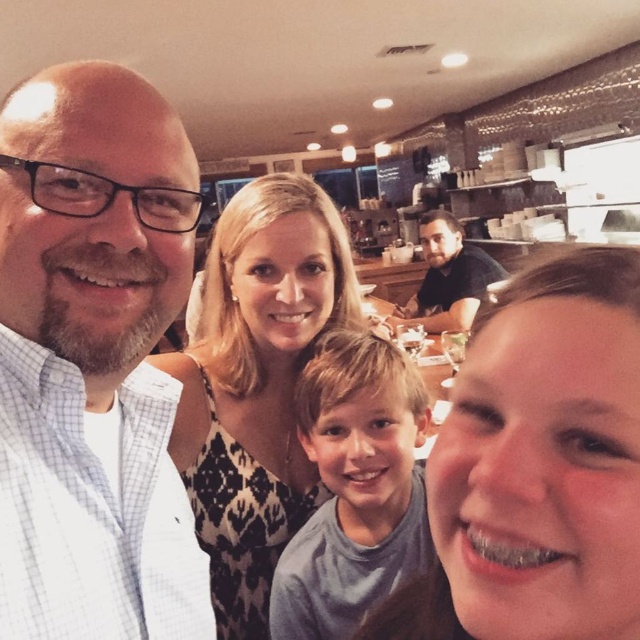
Can you confirm if smooth skin face at lower right is thinner than gray cotton shirt at center?

Correct, smooth skin face at lower right's width is less than gray cotton shirt at center's.

Is point (547, 337) positioned behind point (316, 452)?

No.

Does point (508, 534) come in front of point (305, 429)?

Yes, point (508, 534) is closer to viewer.

Image resolution: width=640 pixels, height=640 pixels. In order to click on smooth skin face at lower right in this screenshot , I will do `click(538, 467)`.

Measure the distance from black printed dress at center to dark brown leather jacket at center.

black printed dress at center is 2.16 meters from dark brown leather jacket at center.

Does point (260, 218) come in front of point (440, 248)?

Yes, point (260, 218) is in front of point (440, 248).

I want to click on black printed dress at center, so click(x=257, y=384).

Is gray cotton shirt at center taller than dark brown leather jacket at center?

Incorrect, gray cotton shirt at center's height is not larger of dark brown leather jacket at center's.

Locate an element on the screen. The width and height of the screenshot is (640, 640). gray cotton shirt at center is located at coordinates (355, 488).

I want to click on gray cotton shirt at center, so click(355, 488).

The height and width of the screenshot is (640, 640). What are the coordinates of `gray cotton shirt at center` in the screenshot? It's located at (355, 488).